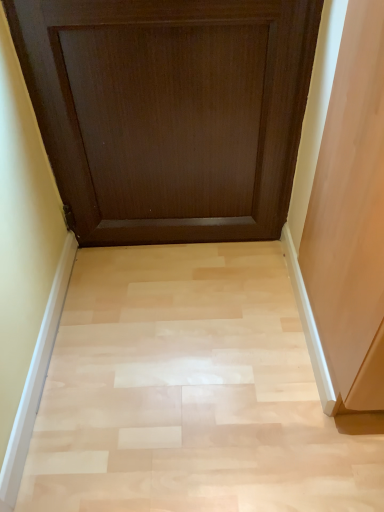
Find the location of `free space in front of dark wood door at upper center`. free space in front of dark wood door at upper center is located at coordinates (183, 351).